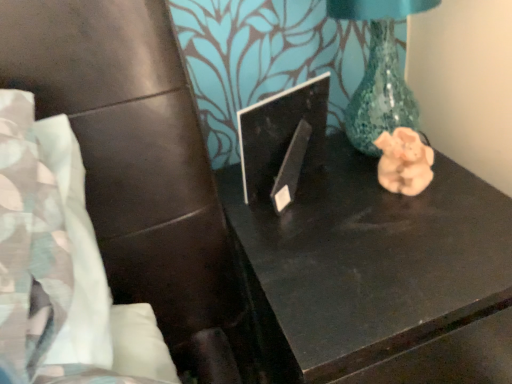
Question: From a real-world perspective, is black glossy table at center beneath black glossy laptop at center?

Choices:
 (A) no
 (B) yes

Answer: (B)

Question: Is black glossy laptop at center inside black glossy table at center?

Choices:
 (A) yes
 (B) no

Answer: (B)

Question: Is black glossy table at center shorter than black glossy laptop at center?

Choices:
 (A) no
 (B) yes

Answer: (A)

Question: Does black glossy table at center lie in front of black glossy laptop at center?

Choices:
 (A) yes
 (B) no

Answer: (A)

Question: Can you confirm if black glossy table at center is thinner than black glossy laptop at center?

Choices:
 (A) yes
 (B) no

Answer: (B)

Question: Does black glossy table at center touch black glossy laptop at center?

Choices:
 (A) no
 (B) yes

Answer: (A)

Question: From a real-world perspective, is black glossy laptop at center under black glossy table at center?

Choices:
 (A) no
 (B) yes

Answer: (A)

Question: Can you confirm if black glossy laptop at center is wider than black glossy table at center?

Choices:
 (A) yes
 (B) no

Answer: (B)

Question: Considering the relative sizes of black glossy laptop at center and black glossy table at center in the image provided, is black glossy laptop at center smaller than black glossy table at center?

Choices:
 (A) yes
 (B) no

Answer: (A)

Question: Could black glossy table at center be considered to be inside black glossy laptop at center?

Choices:
 (A) no
 (B) yes

Answer: (A)

Question: Is black glossy laptop at center placed right next to black glossy table at center?

Choices:
 (A) no
 (B) yes

Answer: (A)

Question: Does black glossy laptop at center have a larger size compared to black glossy table at center?

Choices:
 (A) yes
 (B) no

Answer: (B)

Question: From the image's perspective, would you say pink clay pig at right is shown under black glossy table at center?

Choices:
 (A) no
 (B) yes

Answer: (A)